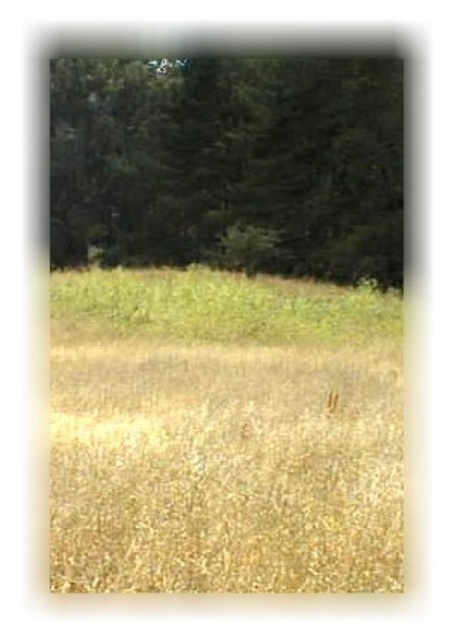
You are standing at the origin point in the image. Where is the dry grass at center located?

The dry grass at center is located at point 0.678 on the x axis and 0.496 on the y axis.

You are standing in a field and want to place a 5 meter long fence that runs from your current position to the dry grass at center. Is the distance sufficient to place the fence without it being too short?

The distance of dry grass at center from viewer is 4.62 meters, so the 5 meter long fence would be too long and would not fit within the required space.

You are standing in the field and see the dry grass at center and the green matte tree at upper center. Which object is positioned to the right of the other?

The dry grass at center is to the right of the green matte tree at upper center.